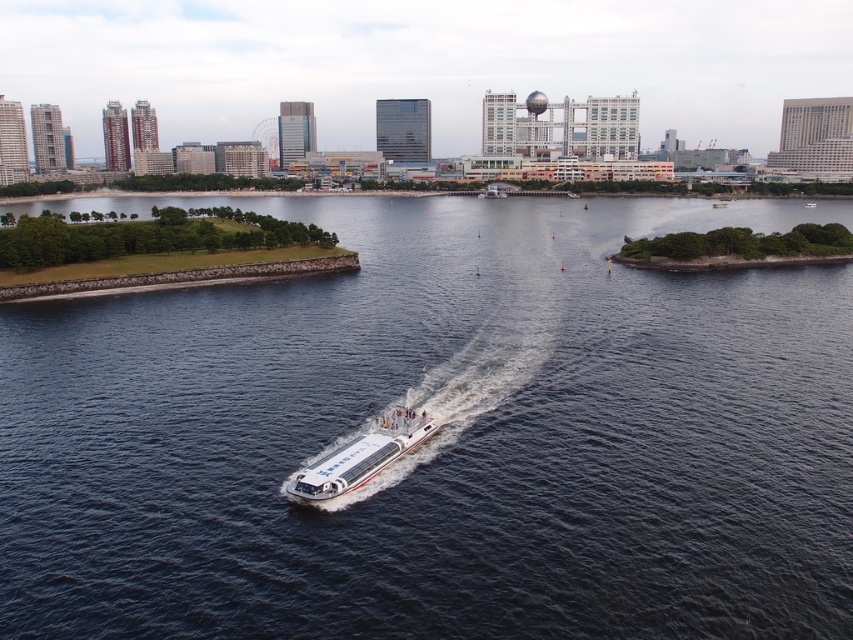
Is the position of dark blue water at center more distant than that of white glossy boat at center?

No, it is not.

Is dark blue water at center smaller than white glossy boat at center?

No.

What do you see at coordinates (440, 436) in the screenshot?
I see `dark blue water at center` at bounding box center [440, 436].

Locate an element on the screen. Image resolution: width=853 pixels, height=640 pixels. dark blue water at center is located at coordinates (440, 436).